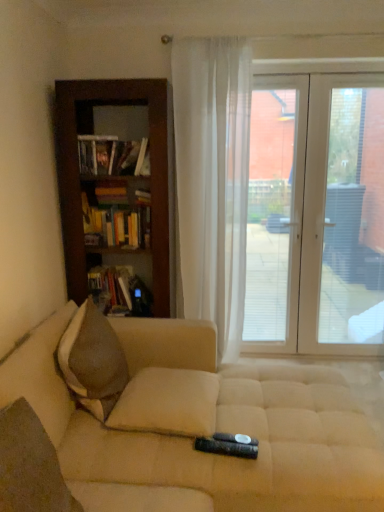
Question: Considering the positions of brown textured pillow at lower left, which is the 2th pillow from back to front, and hardcover book at left, marked as the third book in a bottom-to-top arrangement, in the image, is brown textured pillow at lower left, which is the 2th pillow from back to front, taller or shorter than hardcover book at left, marked as the third book in a bottom-to-top arrangement,?

Choices:
 (A) short
 (B) tall

Answer: (B)

Question: In terms of width, does brown textured pillow at lower left, which appears as the first pillow when viewed from the front, look wider or thinner when compared to hardcover book at left, which ranks as the first book in top-to-bottom order?

Choices:
 (A) wide
 (B) thin

Answer: (A)

Question: Estimate the real-world distances between objects in this image. Which object is closer to the beige fabric couch at lower center?

Choices:
 (A) transparent glass door at right, which is the first window screen from right to left
 (B) white sheer curtain at center
 (C) brown textured pillow at lower left, which is the 2th pillow from back to front
 (D) transparent plastic window screen at center, which is the first window screen in left-to-right order
 (E) brown textured pillow at left

Answer: (E)

Question: Which object is the closest to the beige fabric couch at lower center?

Choices:
 (A) transparent plastic window screen at center, the second window screen from the right
 (B) white glass door at right
 (C) brown textured pillow at left
 (D) brown textured pillow at lower left, arranged as the second pillow when viewed from the right
 (E) hardcover books at left, which is counted as the second book, starting from the bottom

Answer: (C)